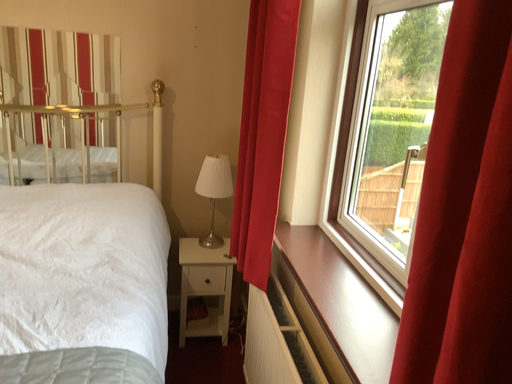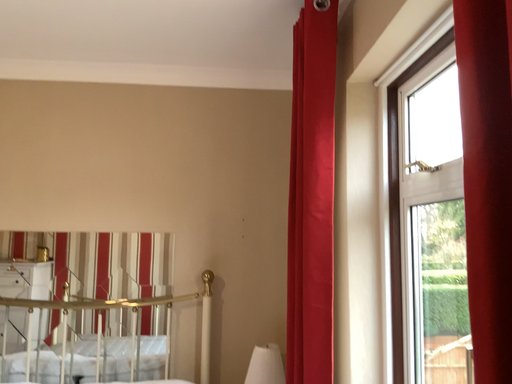
Question: How did the camera likely rotate when shooting the video?

Choices:
 (A) rotated upward
 (B) rotated downward

Answer: (A)